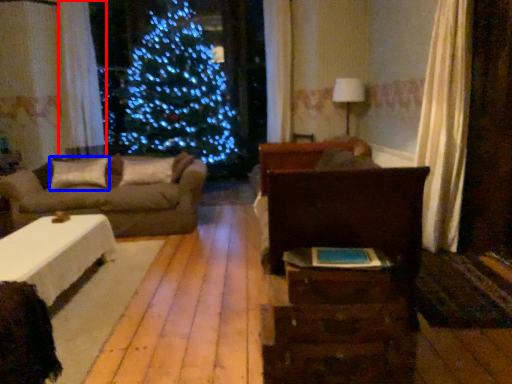
Question: Which object appears farthest to the camera in this image, curtain (highlighted by a red box) or pillow (highlighted by a blue box)?

Choices:
 (A) curtain
 (B) pillow

Answer: (A)